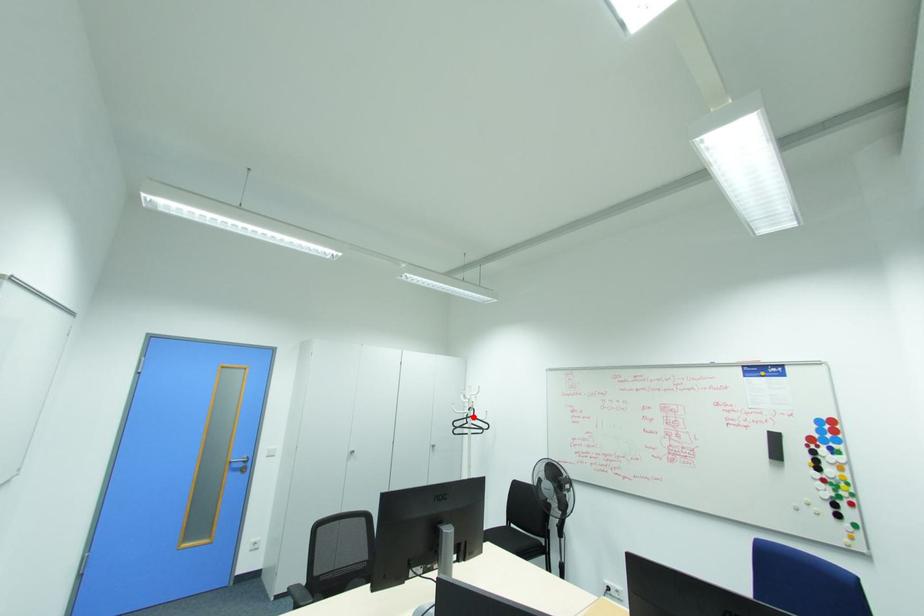
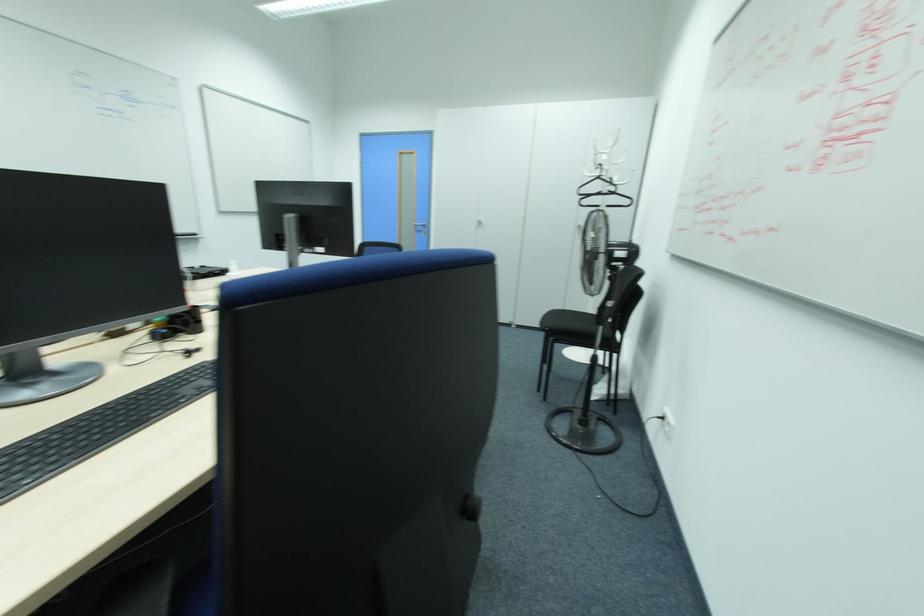
Find the pixel in the second image that matches the highlighted location in the first image.

(599, 177)